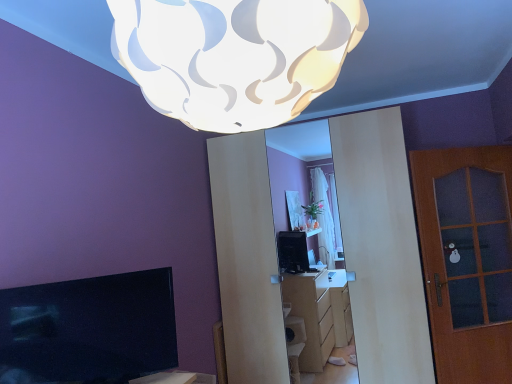
At what (x,y) coordinates should I click in order to perform the action: click on brown wooden door at right. Please return your answer as a coordinate pair (x, y). Looking at the image, I should click on (467, 259).

Could you tell me if brown wooden door at right is turned towards matte black tv at lower left?

No, brown wooden door at right does not turn towards matte black tv at lower left.

Is brown wooden door at right behind matte black tv at lower left?

Yes, it is.

From the picture: Would you say brown wooden door at right is to the left or to the right of matte black tv at lower left in the picture?

Based on their positions, brown wooden door at right is located to the right of matte black tv at lower left.

From a real-world perspective, which is physically below, brown wooden door at right or matte black tv at lower left?

In real-world perspective, brown wooden door at right is lower.

From a real-world perspective, is matte black tv at lower left beneath brown wooden door at right?

No, from a real-world perspective, matte black tv at lower left is not below brown wooden door at right.

Between point (119, 329) and point (487, 292), which one is positioned in front?

The point (119, 329) is more forward.

From the image's perspective, between matte black tv at lower left and brown wooden door at right, who is located below?

From the image's view, matte black tv at lower left is below.

Is the surface of matte black tv at lower left in direct contact with brown wooden door at right?

There is a gap between matte black tv at lower left and brown wooden door at right.

Considering the relative positions of white textured lampshade at upper center and brown wooden door at right in the image provided, is white textured lampshade at upper center to the left of brown wooden door at right from the viewer's perspective?

Correct, you'll find white textured lampshade at upper center to the left of brown wooden door at right.

The height and width of the screenshot is (384, 512). What are the coordinates of `door that appears on the right of white textured lampshade at upper center` in the screenshot? It's located at (467, 259).

From a real-world perspective, is white textured lampshade at upper center physically located above or below brown wooden door at right?

white textured lampshade at upper center is above brown wooden door at right.

Is white textured lampshade at upper center inside or outside of brown wooden door at right?

white textured lampshade at upper center is spatially situated outside brown wooden door at right.

Does brown wooden door at right have a lesser height compared to white textured lampshade at upper center?

In fact, brown wooden door at right may be taller than white textured lampshade at upper center.

Is white textured lampshade at upper center at the back of brown wooden door at right?

brown wooden door at right does not have its back to white textured lampshade at upper center.

At what (x,y) coordinates should I click in order to perform the action: click on lamp above the brown wooden door at right (from a real-world perspective). Please return your answer as a coordinate pair (x, y). This screenshot has height=384, width=512. Looking at the image, I should click on tap(234, 56).

Looking at this image, how far apart are brown wooden door at right and white textured lampshade at upper center?

brown wooden door at right is 2.48 meters from white textured lampshade at upper center.

Consider the image. Does matte black tv at lower left turn towards white textured lampshade at upper center?

No, matte black tv at lower left is not aimed at white textured lampshade at upper center.

From a real-world perspective, is matte black tv at lower left positioned over white textured lampshade at upper center based on gravity?

No, from a real-world perspective, matte black tv at lower left is not over white textured lampshade at upper center

Does matte black tv at lower left touch white textured lampshade at upper center?

No, matte black tv at lower left is not next to white textured lampshade at upper center.

Between white textured lampshade at upper center and matte black tv at lower left, which one is positioned in front?

white textured lampshade at upper center is more forward.

Does white textured lampshade at upper center appear on the right side of matte black tv at lower left?

Indeed, white textured lampshade at upper center is positioned on the right side of matte black tv at lower left.

Based on the photo, from a real-world perspective, who is located lower, white textured lampshade at upper center or matte black tv at lower left?

matte black tv at lower left is physically lower.

Where is `door behind the matte black tv at lower left`? door behind the matte black tv at lower left is located at coordinates (467, 259).

Identify the location of television on the left side of brown wooden door at right. (91, 327).

Looking at the image, which one is located further to brown wooden door at right, matte black tv at lower left or white textured lampshade at upper center?

Based on the image, white textured lampshade at upper center appears to be further to brown wooden door at right.

Looking at the image, which one is located further to brown wooden door at right, white textured lampshade at upper center or matte black tv at lower left?

white textured lampshade at upper center is positioned further to the anchor brown wooden door at right.

From the image, which object appears to be nearer to white textured lampshade at upper center, brown wooden door at right or matte black tv at lower left?

The object closer to white textured lampshade at upper center is matte black tv at lower left.

From the image, which object appears to be farther from matte black tv at lower left, white textured lampshade at upper center or brown wooden door at right?

brown wooden door at right lies further to matte black tv at lower left than the other object.

When comparing their distances from white textured lampshade at upper center, does matte black tv at lower left or brown wooden door at right seem closer?

matte black tv at lower left is positioned closer to the anchor white textured lampshade at upper center.

Which object lies nearer to the anchor point matte black tv at lower left, brown wooden door at right or white textured lampshade at upper center?

Based on the image, white textured lampshade at upper center appears to be nearer to matte black tv at lower left.

Find the location of a particular element. The image size is (512, 384). television between white textured lampshade at upper center and brown wooden door at right along the z-axis is located at coordinates (91, 327).